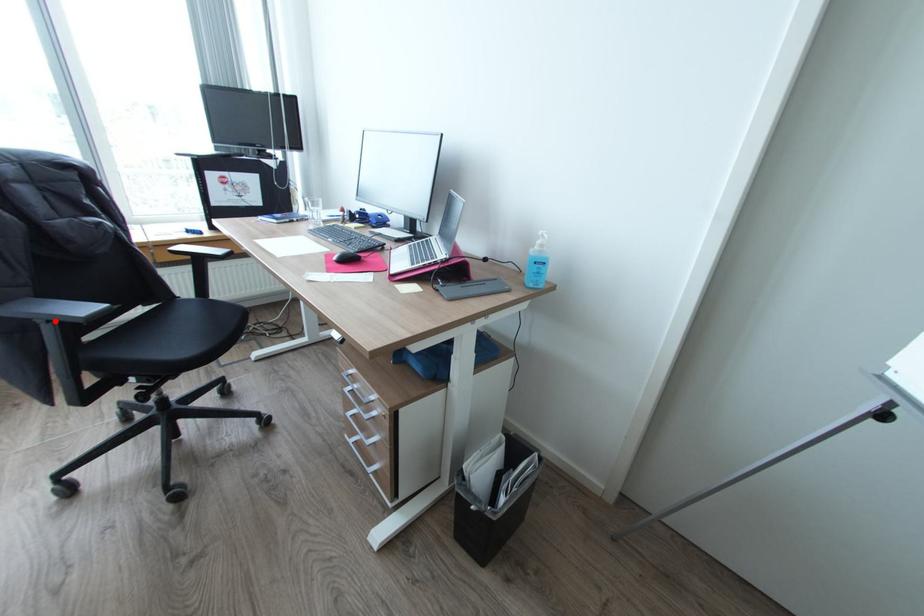
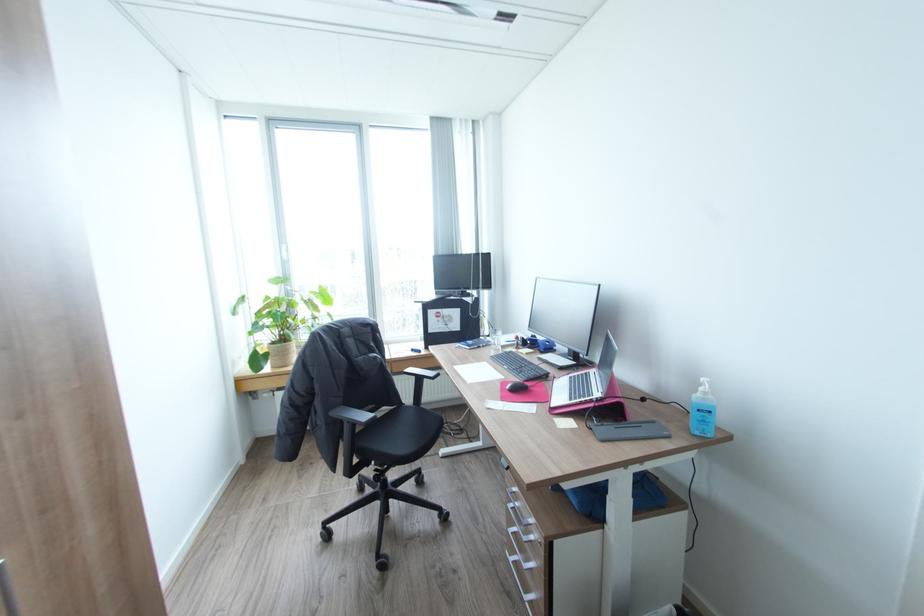
Question: I am providing you with two images of the same scene from different viewpoints. A red point is shown in image1. For the corresponding object point in image2, is it positioned nearer or farther from the camera?

Choices:
 (A) Nearer
 (B) Farther

Answer: (A)